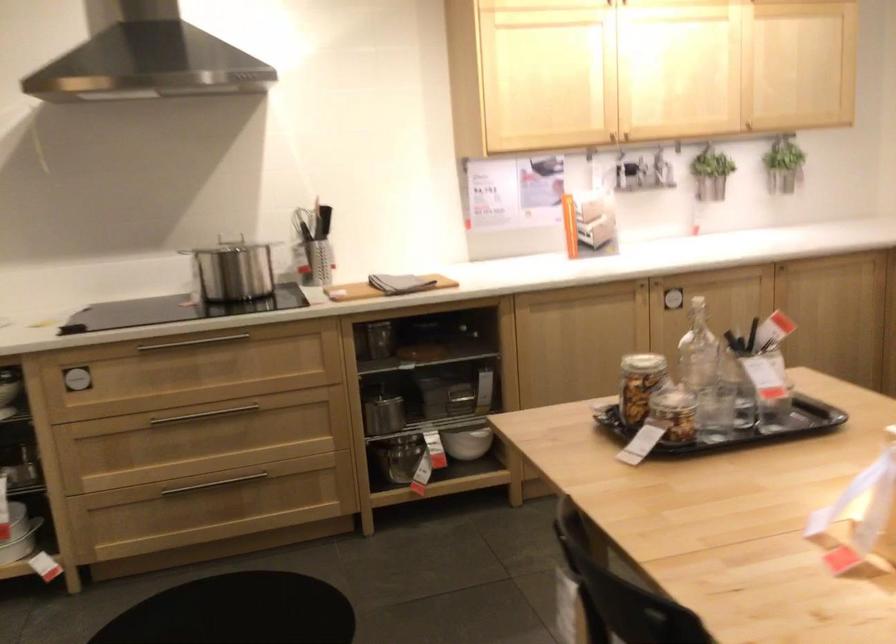
Identify the location of small glass jar. (673, 413).